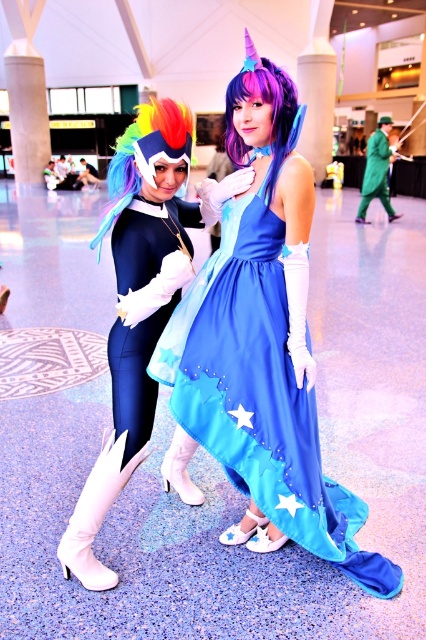
Is matte black bodysuit at left positioned in front of purple silky wig at center?

No.

What do you see at coordinates (138, 305) in the screenshot?
I see `matte black bodysuit at left` at bounding box center [138, 305].

The width and height of the screenshot is (426, 640). I want to click on matte black bodysuit at left, so click(138, 305).

Does blue satin dress at center have a greater height compared to matte black bodysuit at center?

Correct, blue satin dress at center is much taller as matte black bodysuit at center.

Who is more forward, (276, 416) or (158, 310)?

Point (276, 416) is in front.

Where is `blue satin dress at center`? This screenshot has height=640, width=426. blue satin dress at center is located at coordinates (259, 392).

Measure the distance between point (115,256) and camera.

Point (115,256) and camera are 1.88 meters apart from each other.

Measure the distance between matte black bodysuit at center and camera.

matte black bodysuit at center is 6.03 feet away from camera.

Between point (135, 358) and point (242, 164), which one is positioned in front?

Point (135, 358)

Where is `matte black bodysuit at center`? matte black bodysuit at center is located at coordinates (135, 376).